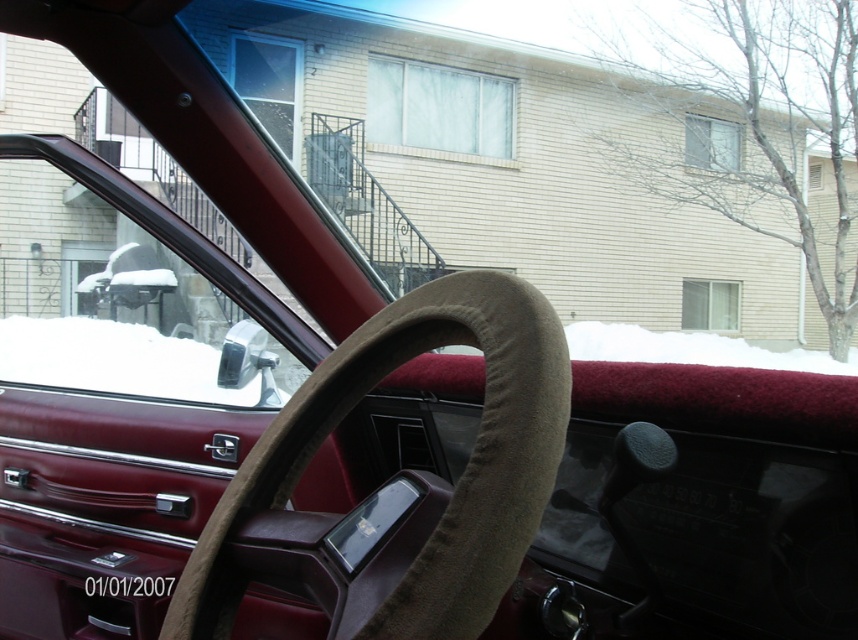
At what (x,y) coordinates should I click in order to perform the action: click on brown suede steering wheel at center. Please return your answer as a coordinate pair (x, y). The width and height of the screenshot is (858, 640). Looking at the image, I should click on point(426,484).

Is point (414, 595) farther from viewer compared to point (450, 353)?

No.

Is point (352, 404) farther from viewer compared to point (572, 332)?

No.

You are a GUI agent. You are given a task and a screenshot of the screen. Output one action in this format:
    pyautogui.click(x=<x>, y=<y>)
    Task: Click on the brown suede steering wheel at center
    This screenshot has height=640, width=858.
    Given the screenshot: What is the action you would take?
    pyautogui.click(x=426, y=484)